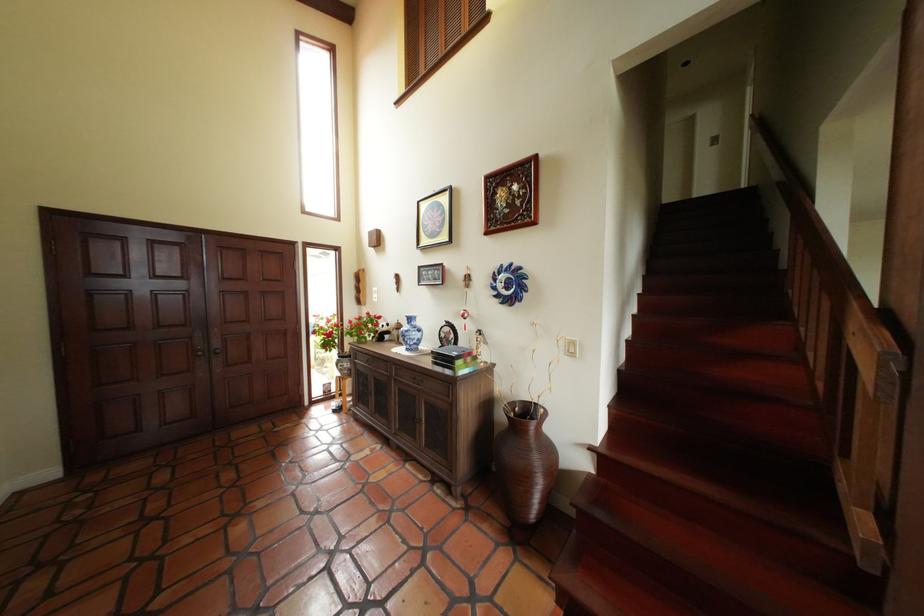
Where would you pull the dark door handle? Please return your answer as a coordinate pair (x, y).

(199, 351)